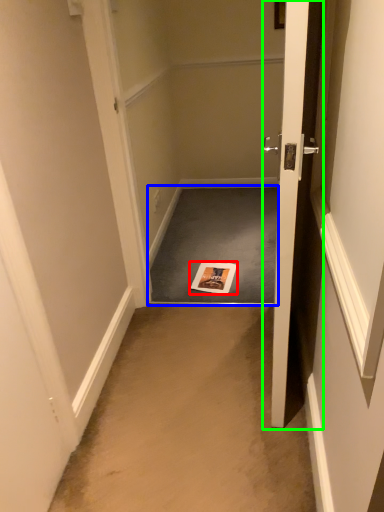
Question: Considering the real-world distances, which object is farthest from magazine (highlighted by a red box)? doormat (highlighted by a blue box) or door (highlighted by a green box)?

Choices:
 (A) doormat
 (B) door

Answer: (B)